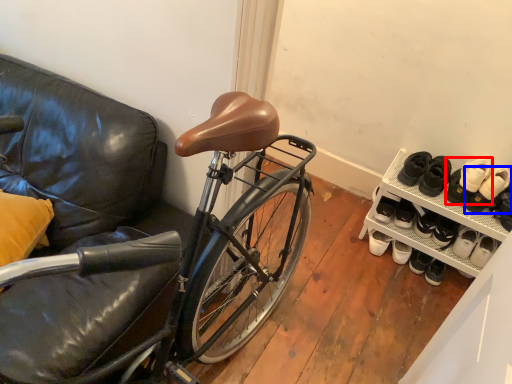
Question: Which object appears farthest to the camera in this image, footwear (highlighted by a red box) or footwear (highlighted by a blue box)?

Choices:
 (A) footwear
 (B) footwear

Answer: (A)